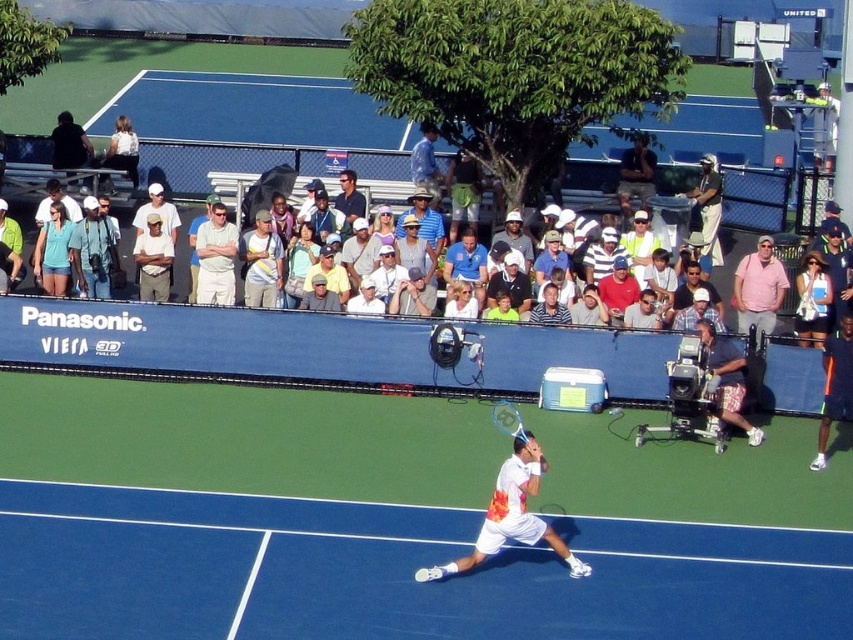
Question: Is white matte tennis racket at center positioned before white cotton shirt at center?

Choices:
 (A) yes
 (B) no

Answer: (A)

Question: Which object is closer to the camera taking this photo?

Choices:
 (A) matte black shirt at center
 (B) white cotton shirt at center
 (C) blue synthetic turf at center

Answer: (C)

Question: Can you confirm if dark blue shorts at right is positioned below white cotton shirt at upper center?

Choices:
 (A) no
 (B) yes

Answer: (B)

Question: Can you confirm if pink cotton shirt at right is positioned below dark blue shirt at center?

Choices:
 (A) no
 (B) yes

Answer: (B)

Question: Which point is farther from the camera taking this photo?

Choices:
 (A) (497, 419)
 (B) (341, 205)
 (C) (59, 291)

Answer: (B)

Question: Which is farther from the white matte tennis racket at center?

Choices:
 (A) dark blue shirt at center
 (B) matte blue shirt at upper left

Answer: (A)